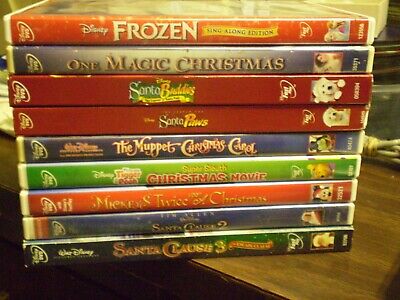
Find the location of a particular element. The image size is (400, 300). dvd is located at coordinates (242, 243), (239, 220), (234, 200), (235, 177), (234, 143), (228, 123), (229, 95), (219, 63), (218, 34).